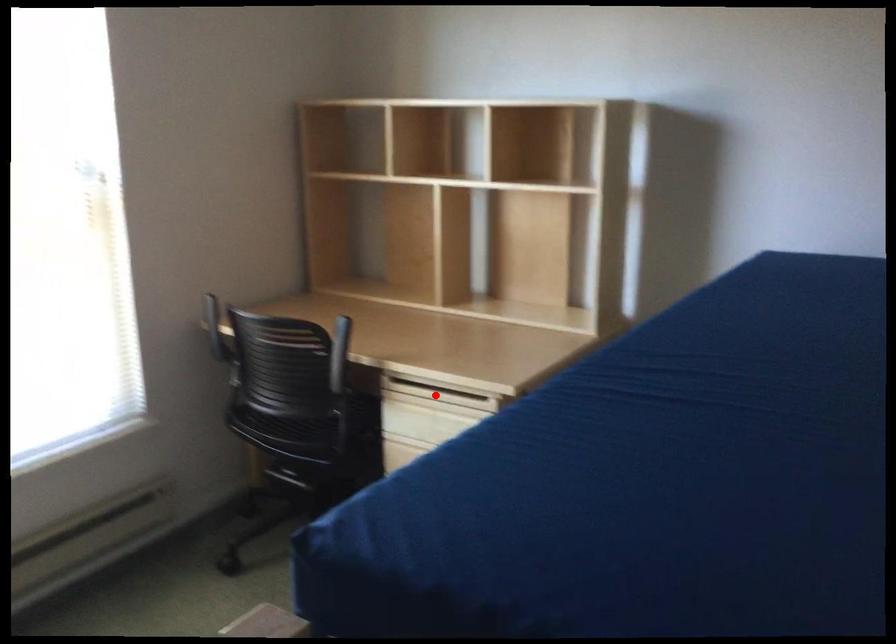
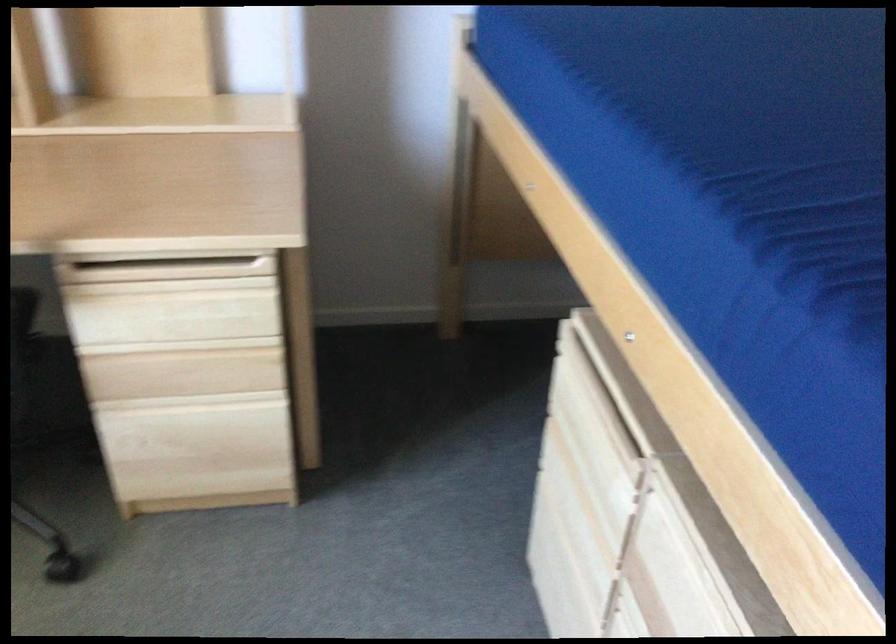
Question: I am providing you with two images of the same scene from different viewpoints. Given a red point in image1, look at the same physical point in image2. Is it:

Choices:
 (A) Closer to the viewpoint
 (B) Farther from the viewpoint

Answer: (A)